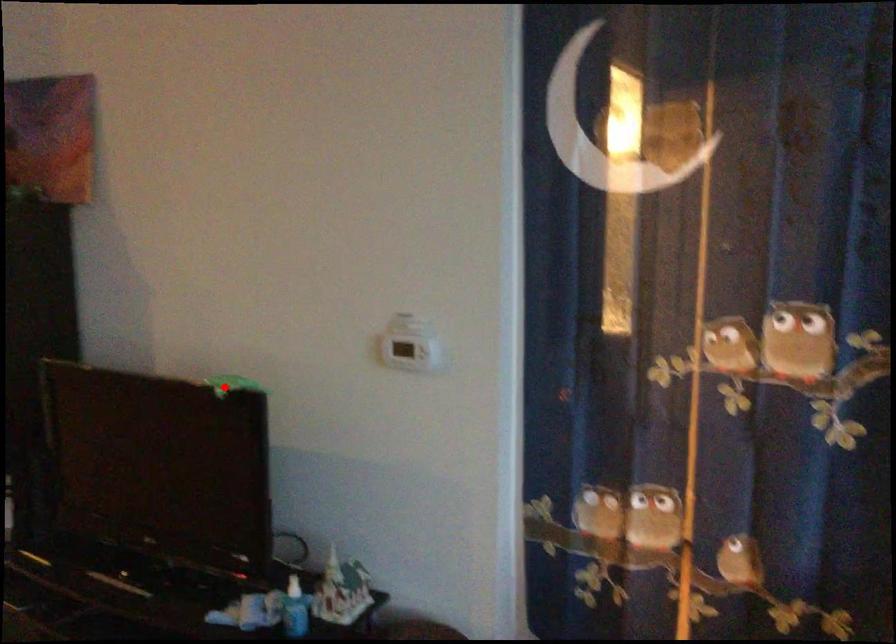
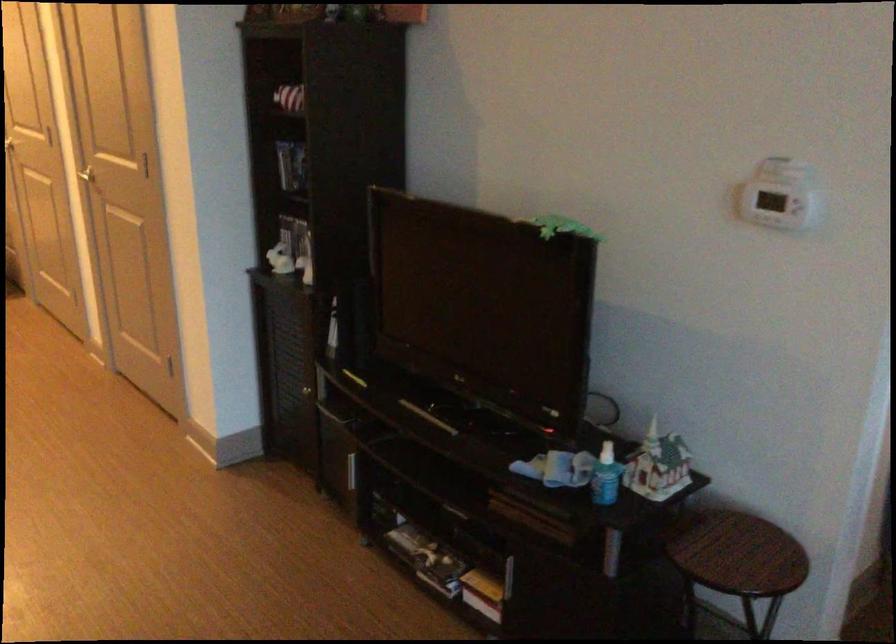
Locate, in the second image, the point that corresponds to the highlighted location in the first image.

(563, 227)